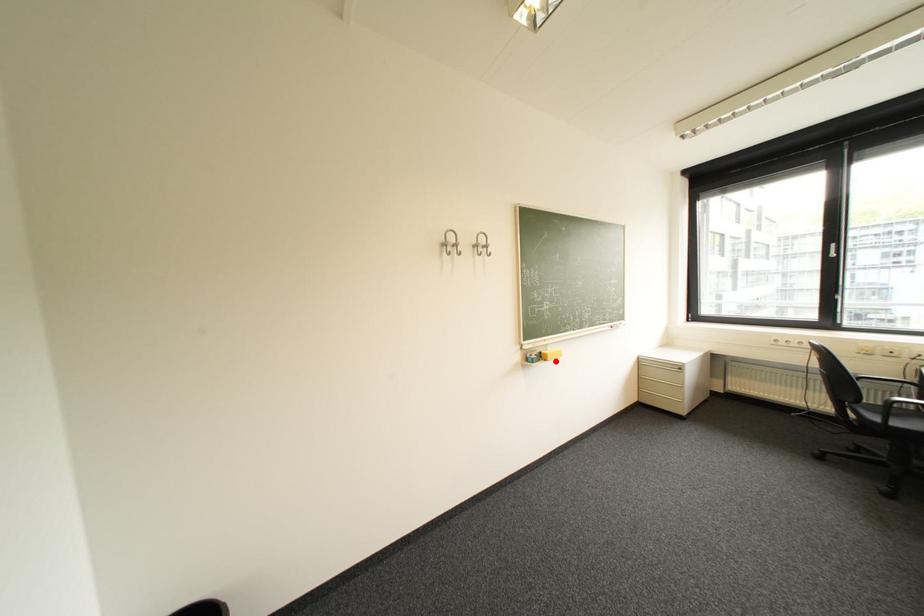
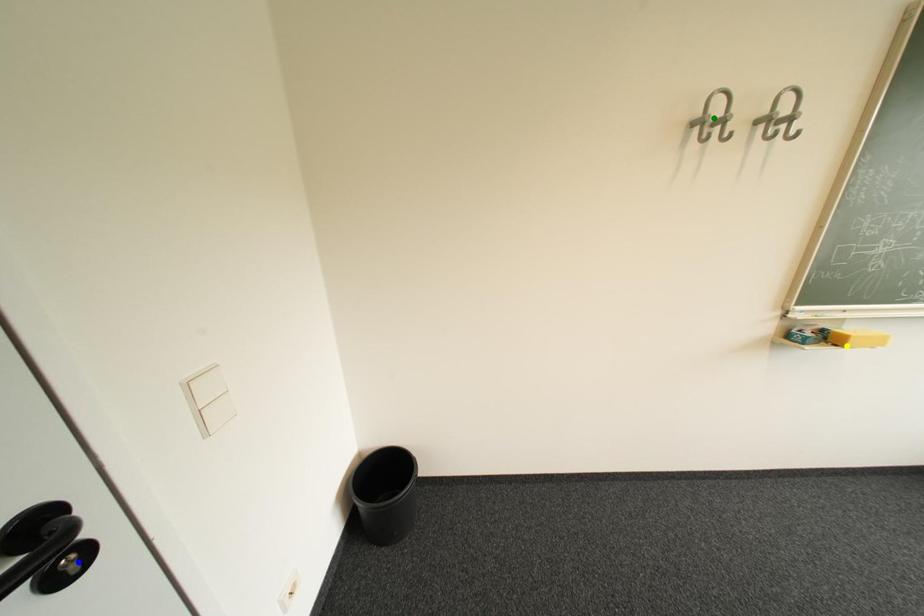
Question: I am providing you with two images of the same scene from different viewpoints. A red point is marked on the first image. You are given multiple points on the second image. Which point in image 2 is actually the same real-world point as the red point in image 1?

Choices:
 (A) yellow point
 (B) blue point
 (C) green point

Answer: (A)